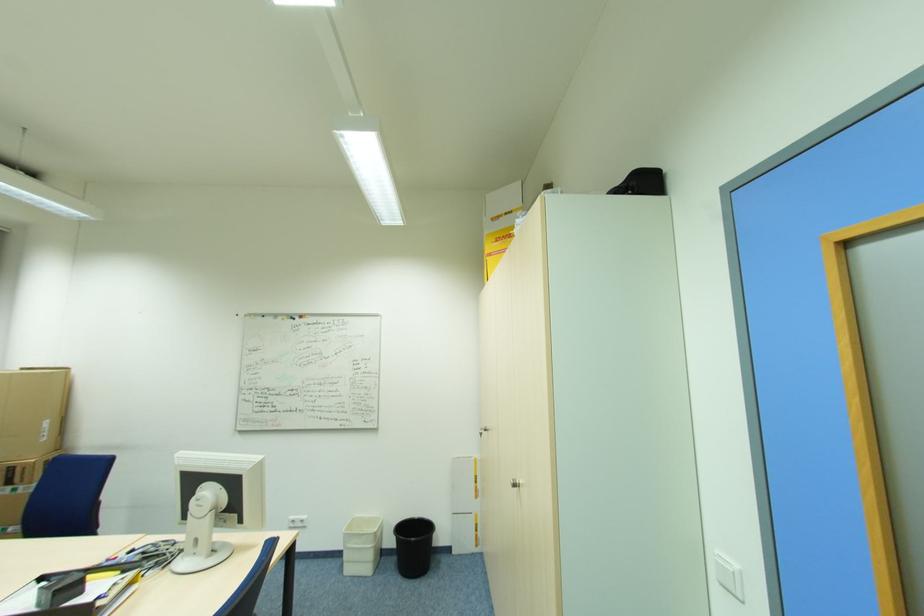
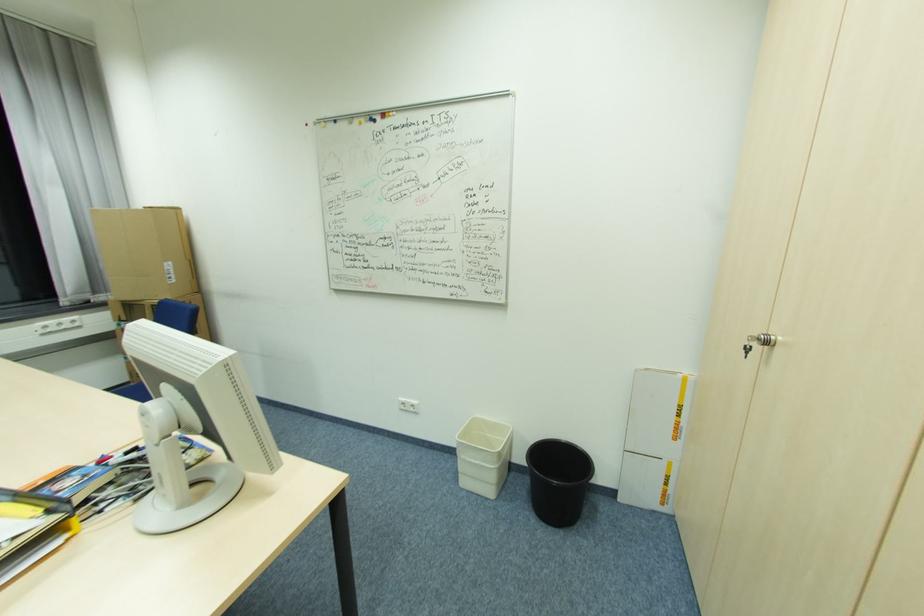
Find the pixel in the second image that matches point 479,491 in the first image.

(681, 430)